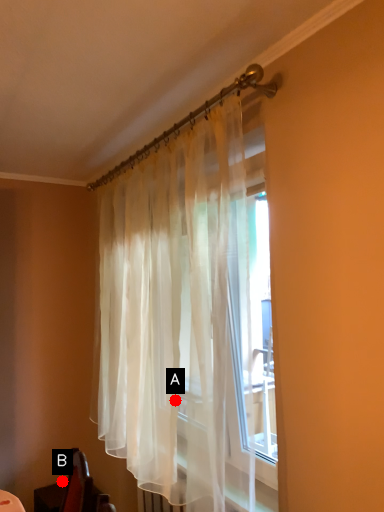
Question: Two points are circled on the image, labeled by A and B beside each circle. Which of the following is the closest to the observer?

Choices:
 (A) A is closer
 (B) B is closer

Answer: (A)